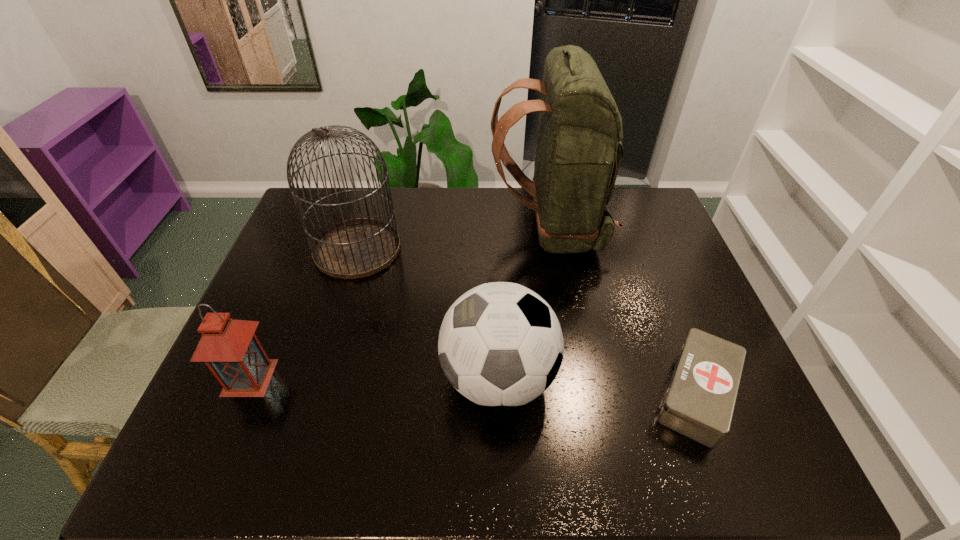
The image size is (960, 540). Identify the location of free region located on the main logo of the soccer ball. (375, 378).

Where is `vacant region located 0.200m on the main logo of the soccer ball`? The height and width of the screenshot is (540, 960). vacant region located 0.200m on the main logo of the soccer ball is located at coordinates tap(359, 378).

The image size is (960, 540). Identify the location of vacant region located on the back of the lantern. (300, 261).

Locate an element on the screen. The height and width of the screenshot is (540, 960). vacant region located on the back of the shortest object is located at coordinates (652, 278).

You are a GUI agent. You are given a task and a screenshot of the screen. Output one action in this format:
    pyautogui.click(x=<x>, y=<y>)
    Task: Click on the backpack that is at the far edge
    
    Given the screenshot: What is the action you would take?
    pyautogui.click(x=578, y=154)

Find the location of `birdcage present at the far edge`. birdcage present at the far edge is located at coordinates (356, 248).

This screenshot has height=540, width=960. Identify the location of object located in the near edge section of the desktop. (699, 403).

The image size is (960, 540). In order to click on birdcage that is at the left edge in this screenshot , I will do `click(356, 248)`.

This screenshot has width=960, height=540. I want to click on lantern that is at the left edge, so click(x=231, y=350).

Identify the location of object that is at the right edge. This screenshot has height=540, width=960. (699, 403).